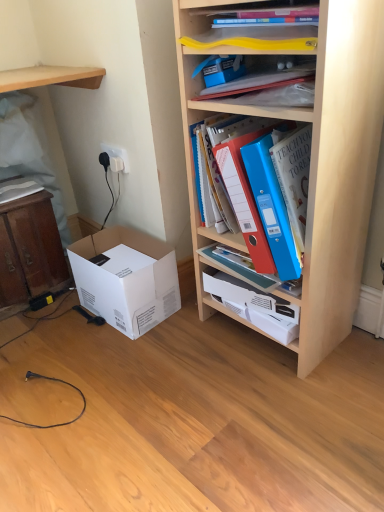
Where is `free spot to the left of wooden bookshelf at upper right, which is the 2th shelf from left to right`? Image resolution: width=384 pixels, height=512 pixels. free spot to the left of wooden bookshelf at upper right, which is the 2th shelf from left to right is located at coordinates (185, 354).